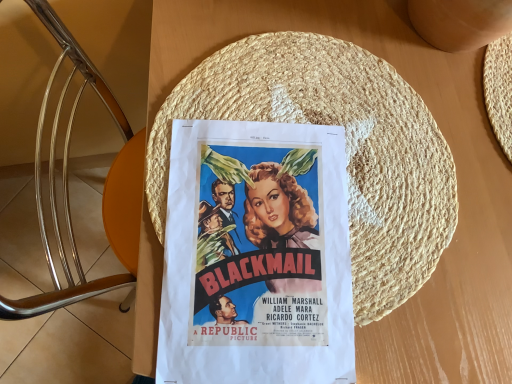
Locate an element on the screen. The width and height of the screenshot is (512, 384). vacant space situated above matte paper poster at center (from a real-world perspective) is located at coordinates (261, 245).